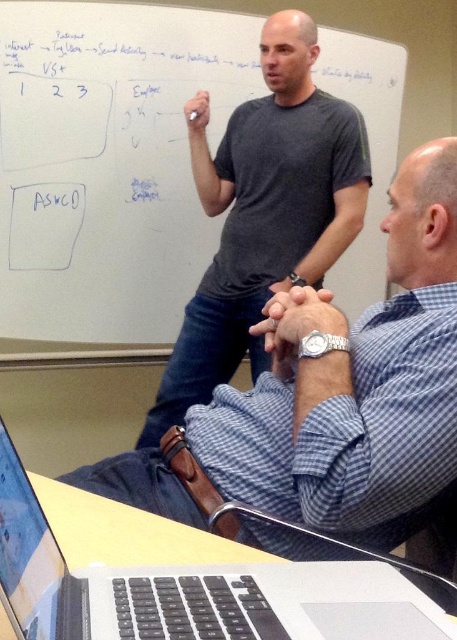
You are organizing a presentation and need to place a name tag on the blue checkered shirt at center so that it doesn t cover the white matte board at upper center. Given their widths, which object should you place the name tag on to ensure visibility?

The white matte board at upper center is wider than the blue checkered shirt at center, so placing the name tag on the blue checkered shirt at center ensures it won t cover the wider board.

You are an attendee in a meeting. You see the white matte board at upper center and the blue checkered shirt at center. Which object is positioned higher in the image?

The white matte board at upper center is positioned higher than the blue checkered shirt at center.